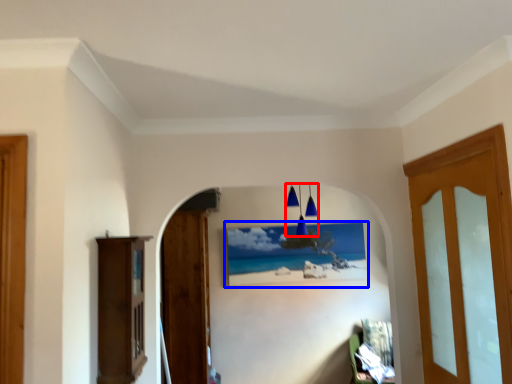
Question: Which object appears farthest to the camera in this image, lamp (highlighted by a red box) or picture frame (highlighted by a blue box)?

Choices:
 (A) lamp
 (B) picture frame

Answer: (B)